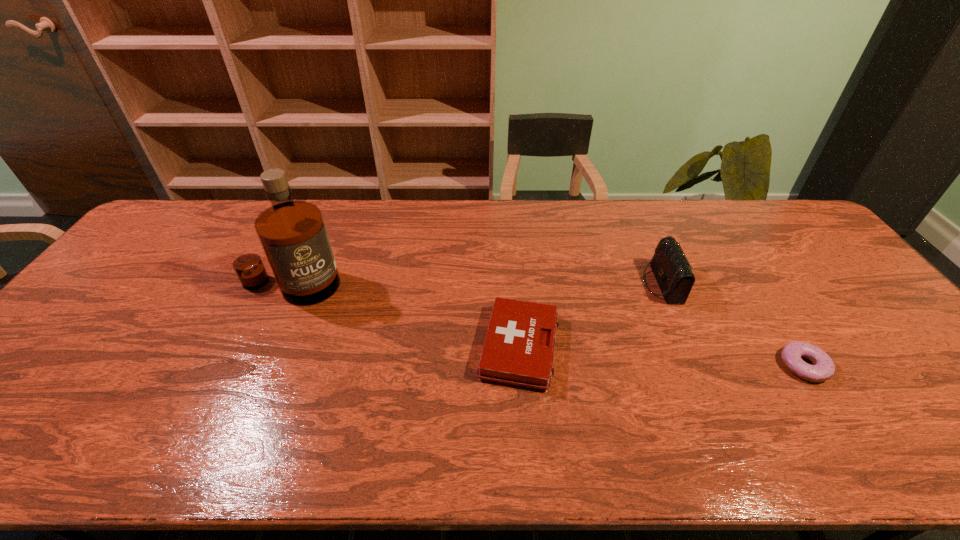
Find the location of `vacant space located 0.290m on the front flap of the third shortest object`. vacant space located 0.290m on the front flap of the third shortest object is located at coordinates (545, 284).

The height and width of the screenshot is (540, 960). I want to click on vacant position located 0.080m on the front flap of the third shortest object, so click(x=617, y=284).

Where is `vacant space located 0.210m on the back of the third tallest object`? vacant space located 0.210m on the back of the third tallest object is located at coordinates (512, 258).

The height and width of the screenshot is (540, 960). Identify the location of free region located on the back of the rightmost object. (738, 264).

Locate an element on the screen. The height and width of the screenshot is (540, 960). vacant space at the far edge is located at coordinates (482, 230).

At what (x,y) coordinates should I click in order to perform the action: click on free space at the near edge of the desktop. Please return your answer as a coordinate pair (x, y). Looking at the image, I should click on (389, 439).

Locate an element on the screen. This screenshot has height=540, width=960. free space at the left edge of the desktop is located at coordinates (128, 269).

Where is `free location at the right edge of the desktop`? The height and width of the screenshot is (540, 960). free location at the right edge of the desktop is located at coordinates (787, 249).

Find the location of `free area in between the second shortest object and the tallest object`. free area in between the second shortest object and the tallest object is located at coordinates (405, 316).

The image size is (960, 540). I want to click on free point between the clutch bag and the first-aid kit, so click(x=590, y=315).